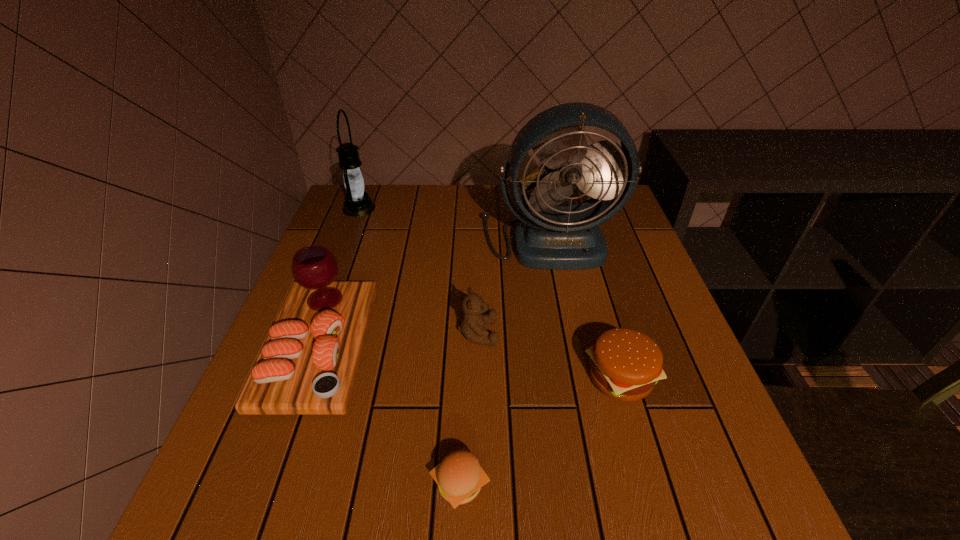
You are a GUI agent. You are given a task and a screenshot of the screen. Output one action in this format:
    pyautogui.click(x=<x>, y=<y>)
    Task: Click on the hamburger that is positioned at the right edge
    This screenshot has width=960, height=540.
    Given the screenshot: What is the action you would take?
    tap(625, 364)

Find the location of a particular element. object located in the far left corner section of the desktop is located at coordinates (358, 203).

The height and width of the screenshot is (540, 960). Identify the location of object that is at the far right corner. (554, 237).

This screenshot has width=960, height=540. In the image, there is a desktop. In order to click on vacant space at the far edge in this screenshot , I will do `click(479, 190)`.

You are a GUI agent. You are given a task and a screenshot of the screen. Output one action in this format:
    pyautogui.click(x=<x>, y=<y>)
    Task: Click on the free region at the near edge of the desktop
    
    Given the screenshot: What is the action you would take?
    pyautogui.click(x=500, y=481)

Identify the location of vacant space at the left edge. The width and height of the screenshot is (960, 540). (349, 280).

In the image, there is a desktop. Where is `vacant area at the right edge`? The width and height of the screenshot is (960, 540). vacant area at the right edge is located at coordinates (621, 255).

The height and width of the screenshot is (540, 960). I want to click on free region at the far right corner of the desktop, so (586, 199).

This screenshot has height=540, width=960. I want to click on vacant space that is in between the platter and the nearer hamburger, so click(x=390, y=416).

The width and height of the screenshot is (960, 540). I want to click on free space between the lantern and the shorter hamburger, so click(410, 346).